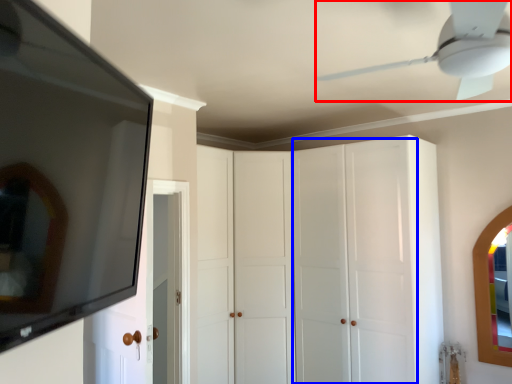
Question: Among these objects, which one is nearest to the camera, ceiling fan (highlighted by a red box) or glass door (highlighted by a blue box)?

Choices:
 (A) ceiling fan
 (B) glass door

Answer: (A)